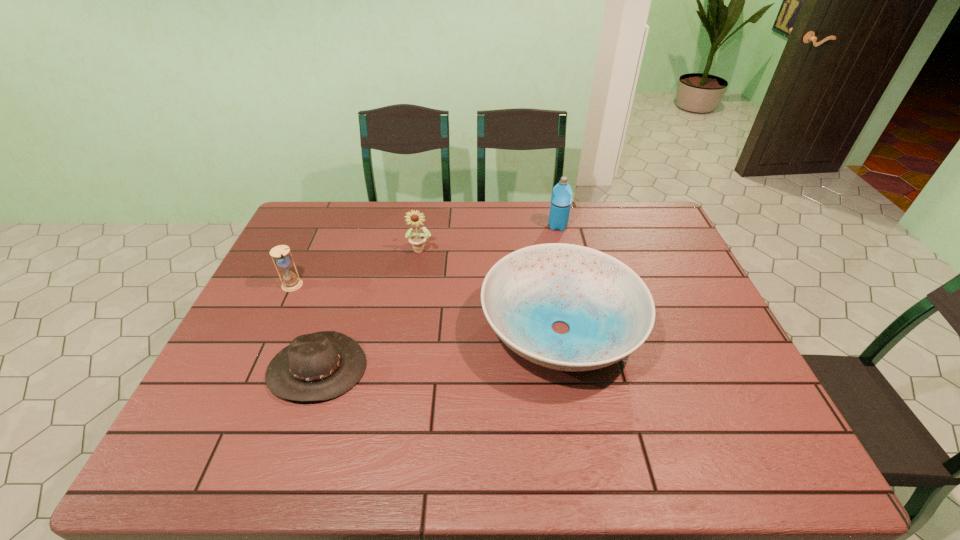
At what (x,y) coordinates should I click in order to perform the action: click on vacant region between the leftmost object and the dish. Please return your answer as a coordinate pair (x, y). The image size is (960, 540). Looking at the image, I should click on pyautogui.click(x=426, y=307).

The height and width of the screenshot is (540, 960). I want to click on vacant space that is in between the hourglass and the sunflower, so click(x=356, y=267).

Find the location of a particular element. This screenshot has width=960, height=540. vacant space that is in between the sunflower and the hourglass is located at coordinates (356, 267).

The image size is (960, 540). I want to click on empty location between the second object from left to right and the hourglass, so click(304, 327).

Locate an element on the screen. This screenshot has height=540, width=960. vacant space in between the leftmost object and the hat is located at coordinates (304, 327).

Locate an element on the screen. The width and height of the screenshot is (960, 540). free point between the sunflower and the leftmost object is located at coordinates (356, 267).

The height and width of the screenshot is (540, 960). What are the coordinates of `free space between the thermos bottle and the hourglass` in the screenshot? It's located at pos(424,256).

Identify which object is the fourth closest to the fourth nearest object. Please provide its 2D coordinates. Your answer should be formatted as a tuple, i.e. [(x, y)], where the tuple contains the x and y coordinates of a point satisfying the conditions above.

[(561, 198)]

Identify which object is the third nearest to the fourth tallest object. Please provide its 2D coordinates. Your answer should be formatted as a tuple, i.e. [(x, y)], where the tuple contains the x and y coordinates of a point satisfying the conditions above.

[(320, 366)]

Find the location of a particular element. This screenshot has width=960, height=540. free point that satisfies the following two spatial constraints: 1. on the front-facing side of the second shortest object; 2. on the left side of the sunflower is located at coordinates (408, 329).